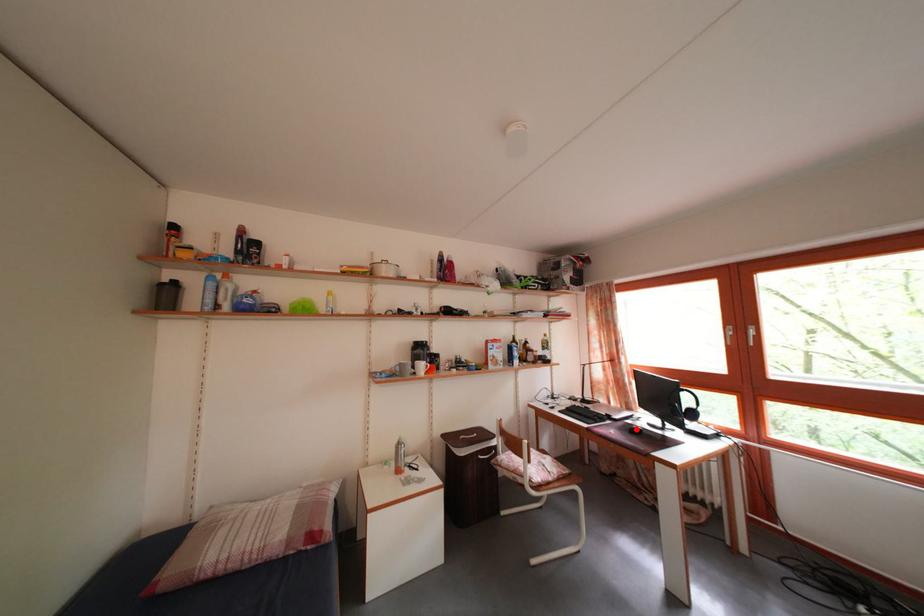
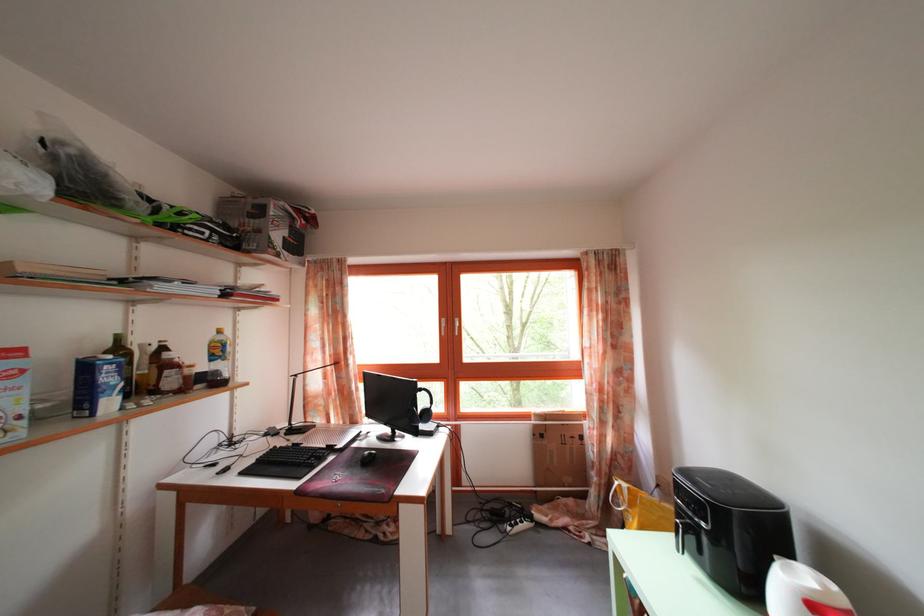
Locate, in the second image, the point that corresponds to the highlighted location in the first image.

(363, 451)